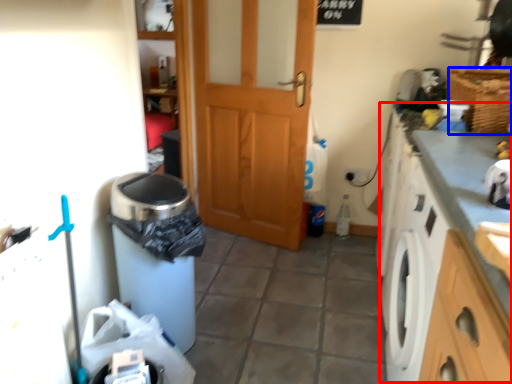
Question: Which object appears closest to the camera in this image, counter top (highlighted by a red box) or basket (highlighted by a blue box)?

Choices:
 (A) counter top
 (B) basket

Answer: (A)